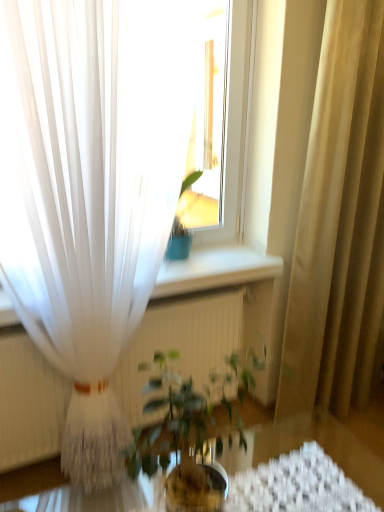
Question: Based on their sizes in the image, would you say green leafy plant at center is bigger or smaller than transparent glass table at center?

Choices:
 (A) small
 (B) big

Answer: (A)

Question: From the image's perspective, is green leafy plant at center positioned above or below transparent glass table at center?

Choices:
 (A) below
 (B) above

Answer: (B)

Question: Which is nearer to the beige fabric curtain at right, which is the 1th curtain in right-to-left order?

Choices:
 (A) green leafy plant at center
 (B) white sheer curtain at left, which appears as the first curtain when viewed from the left
 (C) transparent glass table at center

Answer: (C)

Question: Estimate the real-world distances between objects in this image. Which object is farther from the green leafy plant at center?

Choices:
 (A) beige fabric curtain at right, which is the 1th curtain in right-to-left order
 (B) white sheer curtain at left, which appears as the first curtain when viewed from the left
 (C) transparent glass table at center

Answer: (A)